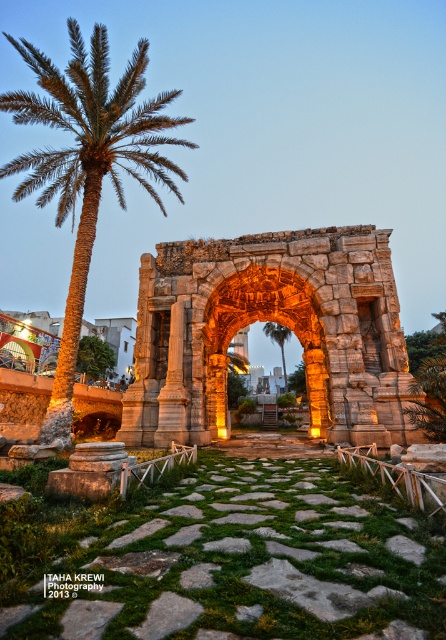
Can you confirm if carved stone arch at center is smaller than green leafy palm at left?

Indeed, carved stone arch at center has a smaller size compared to green leafy palm at left.

Is point (162, 269) behind point (66, 296)?

No, (162, 269) is closer to viewer.

Image resolution: width=446 pixels, height=640 pixels. What are the coordinates of `carved stone arch at center` in the screenshot? It's located at (276, 321).

Which is in front, point (313, 301) or point (288, 387)?

Positioned in front is point (313, 301).

Is carved stone arch at center to the right of green leafy palm tree at left from the viewer's perspective?

Incorrect, carved stone arch at center is not on the right side of green leafy palm tree at left.

Which is in front, point (172, 356) or point (284, 333)?

Point (172, 356)

The width and height of the screenshot is (446, 640). I want to click on carved stone arch at center, so click(x=276, y=321).

Is green leafy palm at left positioned at the back of stone archway at center?

No, green leafy palm at left is closer to the viewer.

Can you confirm if green leafy palm at left is bigger than stone archway at center?

Indeed, green leafy palm at left has a larger size compared to stone archway at center.

I want to click on green leafy palm at left, so click(87, 164).